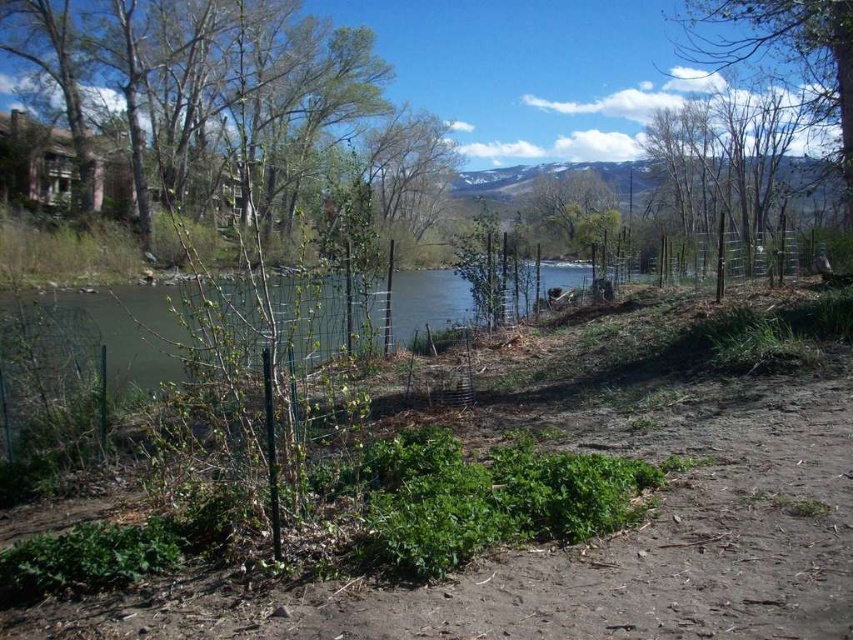
You are standing at the riverside and see a point marked at coordinate (x=785, y=52). What does this point indicate?

The point at coordinate (x=785, y=52) indicates a green leafy tree at upper right.

You are standing at the center of the image and want to locate the green leafy tree at upper left. In which direction should you look to find it?

The green leafy tree at upper left is located at point 0.172 on the x axis and 0.288 on the y axis, so you should look to the upper left direction to find it.